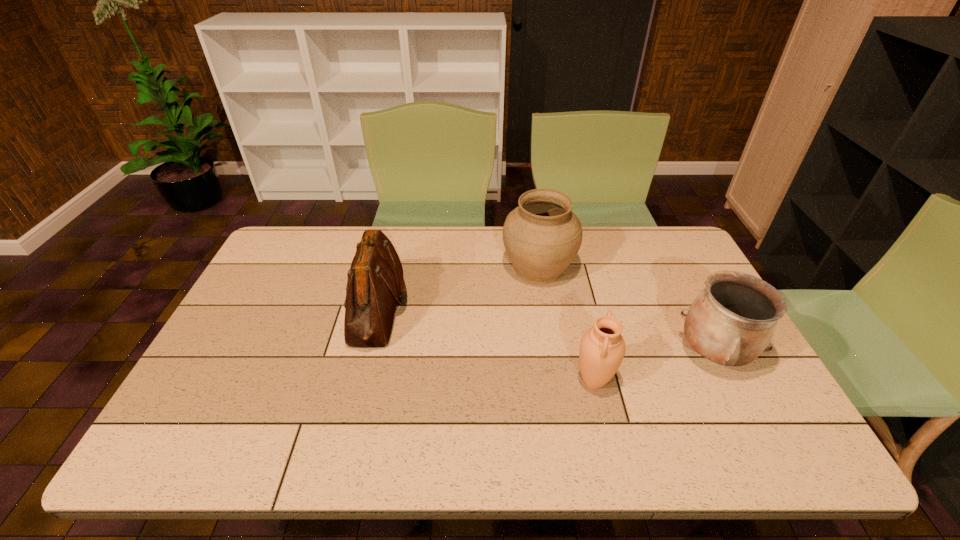
This screenshot has width=960, height=540. Find the location of `the leftmost object`. the leftmost object is located at coordinates (375, 282).

At what (x,y) coordinates should I click in order to perform the action: click on the farthest urn. Please return your answer as a coordinate pair (x, y). The image size is (960, 540). Looking at the image, I should click on (542, 236).

Identify the location of the rightmost urn. This screenshot has width=960, height=540. (731, 322).

Identify the location of blank area located on the front of the shoulder bag. (350, 422).

Identify the location of free region located on the right of the farthest urn. (610, 268).

This screenshot has height=540, width=960. Identify the location of free spot located on the back of the rightmost urn. (674, 276).

Where is `shoulder bag that is at the far edge`? This screenshot has height=540, width=960. shoulder bag that is at the far edge is located at coordinates (375, 282).

At what (x,y) coordinates should I click in order to perform the action: click on urn that is at the far edge. Please return your answer as a coordinate pair (x, y). This screenshot has width=960, height=540. Looking at the image, I should click on (542, 236).

Where is `object that is at the right edge`? object that is at the right edge is located at coordinates (731, 322).

This screenshot has width=960, height=540. I want to click on vacant space at the far edge, so click(x=584, y=251).